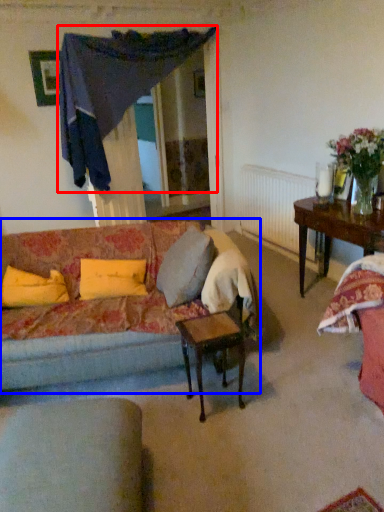
Question: Which object is closer to the camera taking this photo, curtain (highlighted by a red box) or studio couch (highlighted by a blue box)?

Choices:
 (A) curtain
 (B) studio couch

Answer: (B)